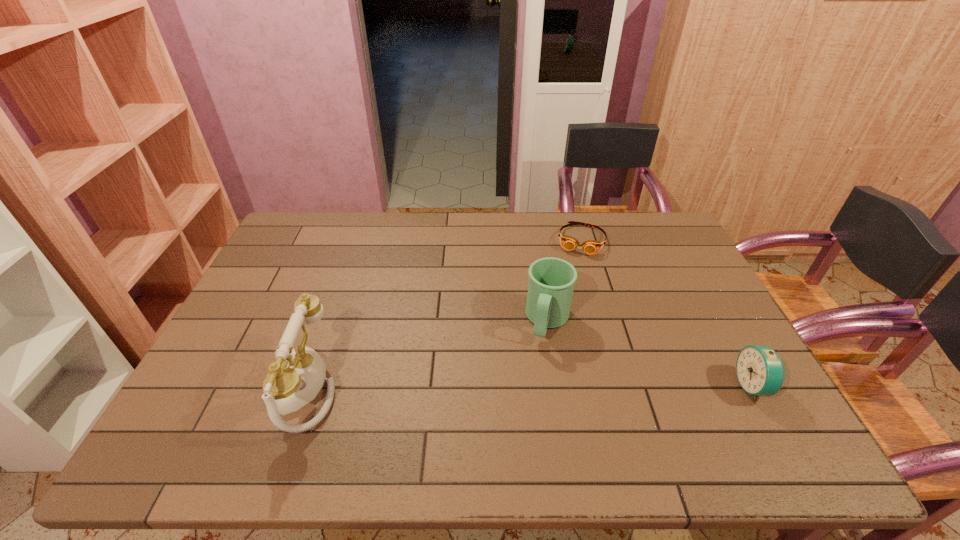
Identify which object is located as the third nearest to the second tallest object. Please provide its 2D coordinates. Your answer should be formatted as a tuple, i.e. [(x, y)], where the tuple contains the x and y coordinates of a point satisfying the conditions above.

[(297, 376)]

You are a GUI agent. You are given a task and a screenshot of the screen. Output one action in this format:
    pyautogui.click(x=<x>, y=<y>)
    Task: Click on the blank space that satisfies the following two spatial constraints: 1. on the front side of the alarm clock; 2. on the front-facing side of the goggles
    
    Given the screenshot: What is the action you would take?
    pyautogui.click(x=624, y=386)

Find the location of a particular element. The height and width of the screenshot is (540, 960). free space that satisfies the following two spatial constraints: 1. on the back side of the mug; 2. on the right side of the farthest object is located at coordinates (536, 240).